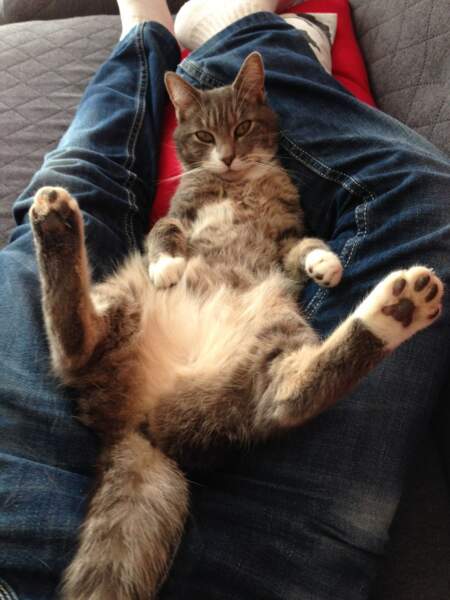
Where is `right white sock`? Image resolution: width=450 pixels, height=600 pixels. right white sock is located at coordinates (212, 16).